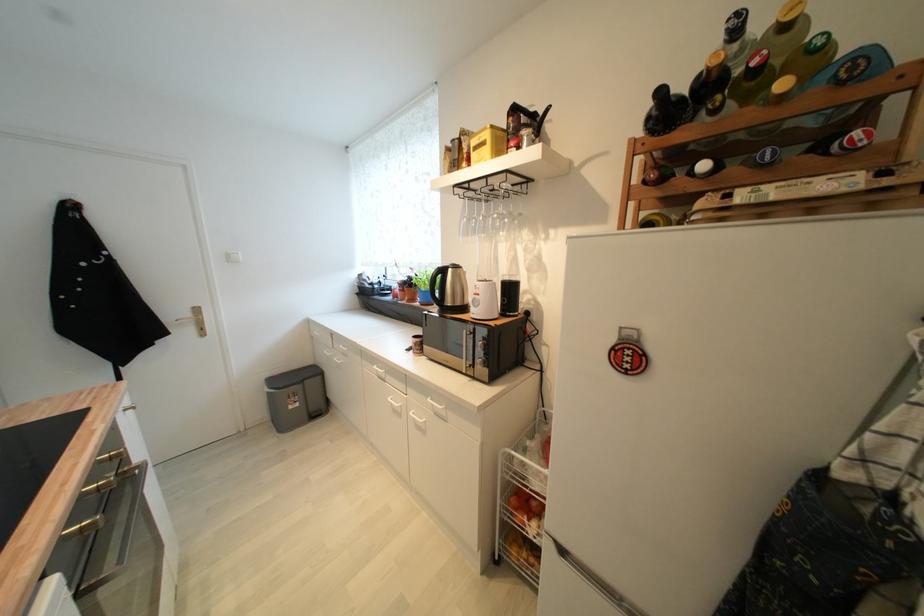
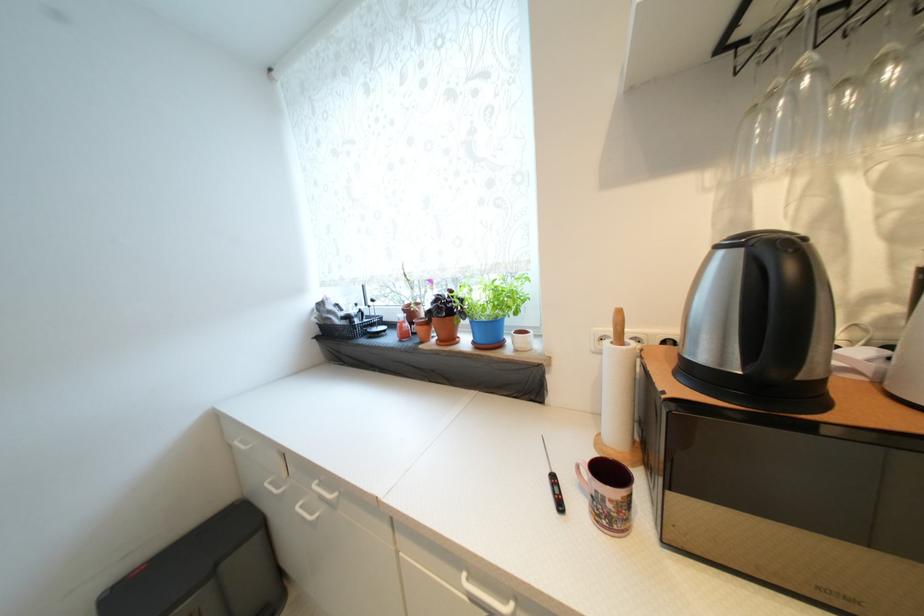
Where in the second image is the point corresponding to point 323,379 from the first image?

(261, 541)